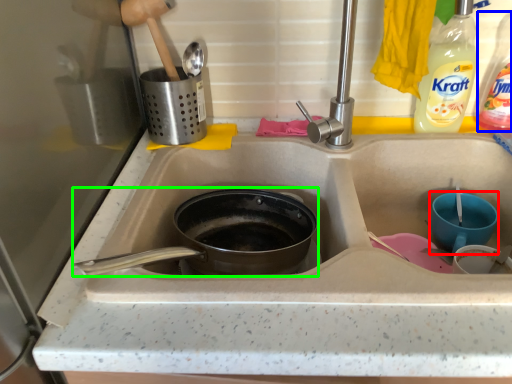
Question: Considering the real-world distances, which object is farthest from basin (highlighted by a red box)? bottle (highlighted by a blue box) or frying pan (highlighted by a green box)?

Choices:
 (A) bottle
 (B) frying pan

Answer: (B)